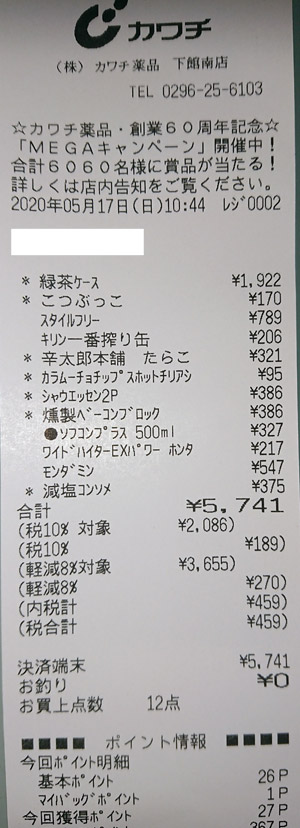
Where is `white bar`? The image size is (300, 828). white bar is located at coordinates (59, 239).